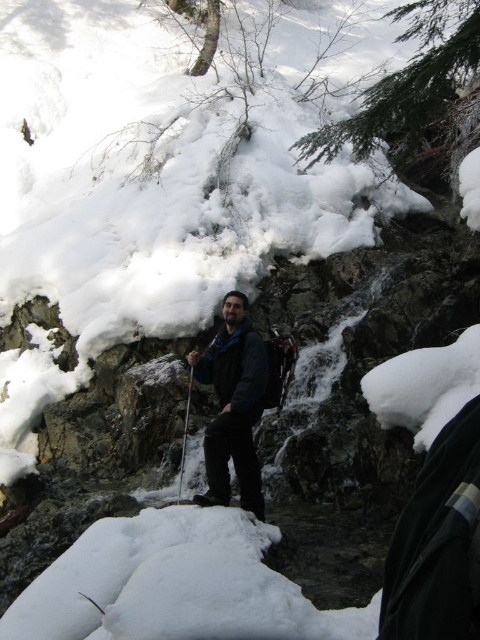
You are a hiker who has just lost your metallic silver ski pole at center in a snowy mountain area. Based on the coordinates provided, where should you look for it?

The metallic silver ski pole at center is located at coordinates point (184,435).